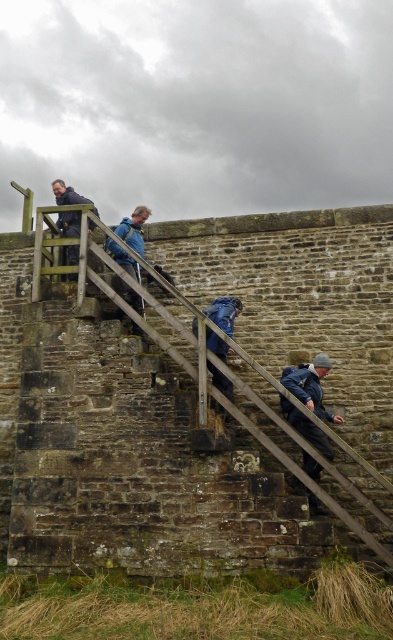
You are a hiker trying to decide which jacket to wear for the hike. You notice the blue fabric jacket at center and the matte black jacket at upper left in the image. Which jacket is shorter in height?

The blue fabric jacket at center is not as tall as matte black jacket at upper left, so the blue fabric jacket at center is shorter in height.

Looking at this image, you are a hiker planning to climb the wooden stairs. You notice the wooden at upper left and the blue fabric jacket at center. Which object is higher up the stairs?

The wooden at upper left is taller than the blue fabric jacket at center, so the wooden at upper left is higher up the stairs.

You are one of the hikers on the wooden stairs. You notice two jackets among the group. Which jacket is positioned to the right of the other? The jackets are the blue fabric jacket at upper center and the matte black jacket at upper left.

The blue fabric jacket at upper center is positioned to the right of the matte black jacket at upper left.